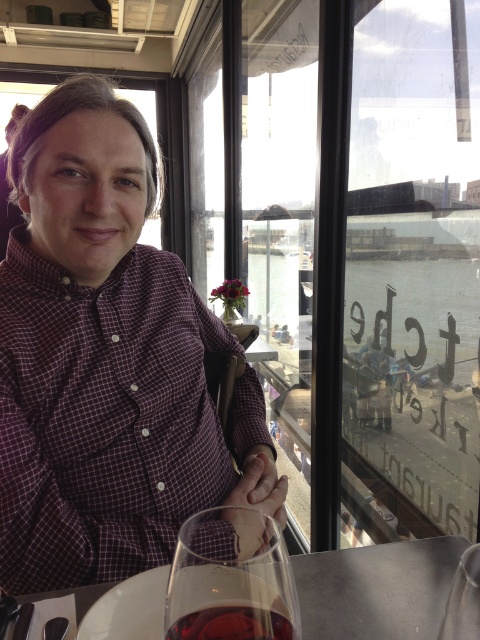
Between purple checkered shirt at center and white glossy table at center, which one appears on the left side from the viewer's perspective?

purple checkered shirt at center is more to the left.

Does purple checkered shirt at center appear on the left side of white glossy table at center?

Indeed, purple checkered shirt at center is positioned on the left side of white glossy table at center.

The image size is (480, 640). In order to click on purple checkered shirt at center in this screenshot , I will do `click(107, 362)`.

I want to click on purple checkered shirt at center, so click(107, 362).

Does white glossy table at center appear on the left side of translucent glass wine at lower center?

Incorrect, white glossy table at center is not on the left side of translucent glass wine at lower center.

Can you confirm if white glossy table at center is positioned above translucent glass wine at lower center?

Incorrect, white glossy table at center is not positioned above translucent glass wine at lower center.

Between point (342, 604) and point (237, 627), which one is positioned in front?

Point (237, 627) is more forward.

Where is `white glossy table at center`? The height and width of the screenshot is (640, 480). white glossy table at center is located at coordinates (376, 589).

Can you confirm if translucent glass wine glass at lower center is thinner than translucent glass wine at lower center?

No.

Does point (190, 568) come in front of point (219, 620)?

Yes.

Is point (264, 628) farther from camera compared to point (232, 630)?

That is False.

What are the coordinates of `translucent glass wine glass at lower center` in the screenshot? It's located at (230, 579).